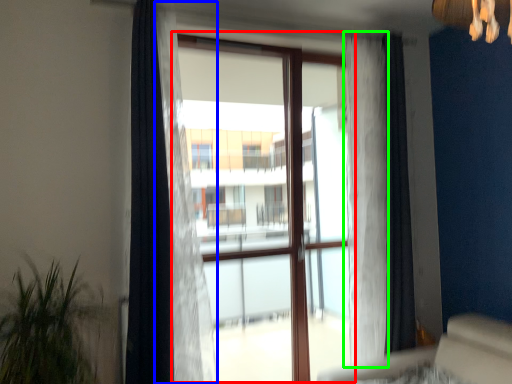
Question: Which is nearer to the bay window (highlighted by a red box)? curtain (highlighted by a blue box) or curtain (highlighted by a green box).

Choices:
 (A) curtain
 (B) curtain

Answer: (B)